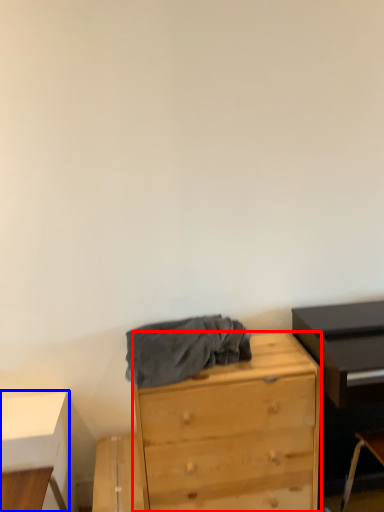
Question: Among these objects, which one is farthest to the camera, chest of drawers (highlighted by a red box) or table (highlighted by a blue box)?

Choices:
 (A) chest of drawers
 (B) table

Answer: (B)